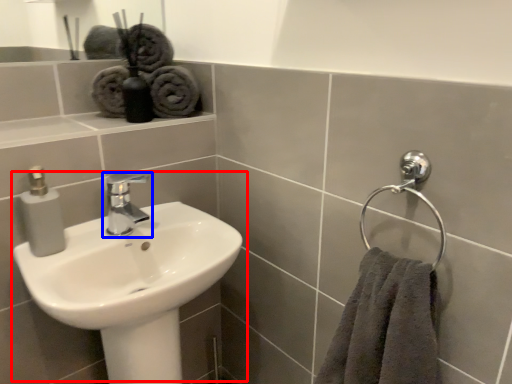
Question: Which point is further to the camera, sink (highlighted by a red box) or tap (highlighted by a blue box)?

Choices:
 (A) sink
 (B) tap

Answer: (B)